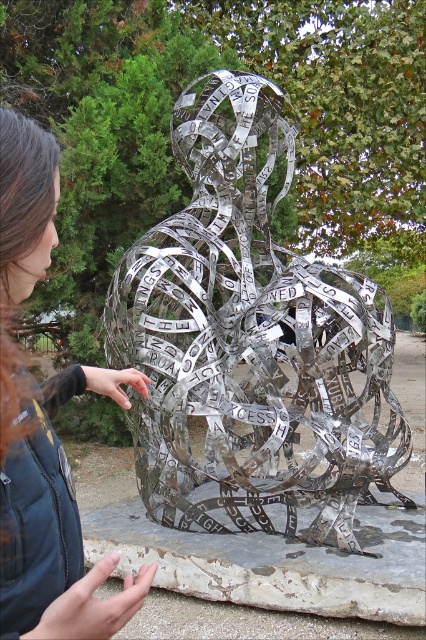
Question: Which point is farther to the camera?

Choices:
 (A) metallic silver sculpture at center
 (B) dark blue jacket at center

Answer: (A)

Question: Can you confirm if metallic silver sculpture at center is thinner than dark blue jacket at center?

Choices:
 (A) no
 (B) yes

Answer: (A)

Question: Is metallic silver sculpture at center in front of dark blue jacket at center?

Choices:
 (A) no
 (B) yes

Answer: (A)

Question: Which object is closer to the camera taking this photo?

Choices:
 (A) metallic silver sculpture at center
 (B) dark blue jacket at center

Answer: (B)

Question: In this image, where is metallic silver sculpture at center located relative to dark blue jacket at center?

Choices:
 (A) below
 (B) above

Answer: (B)